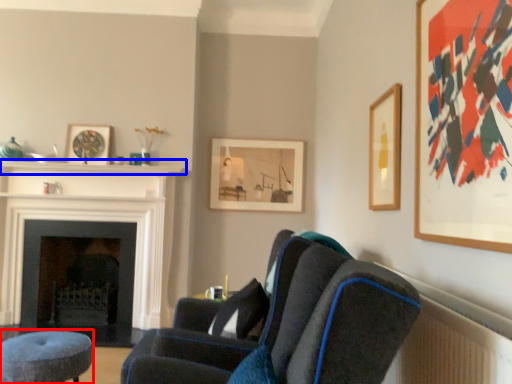
Question: Which object is closer to the camera taking this photo, stool (highlighted by a red box) or balustrade (highlighted by a blue box)?

Choices:
 (A) stool
 (B) balustrade

Answer: (A)